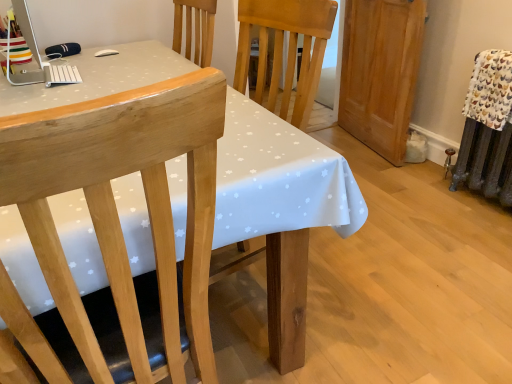
Where is `vacant region below white fabric with chicken print at right (from a real-world perspective)`? Image resolution: width=512 pixels, height=384 pixels. vacant region below white fabric with chicken print at right (from a real-world perspective) is located at coordinates (473, 198).